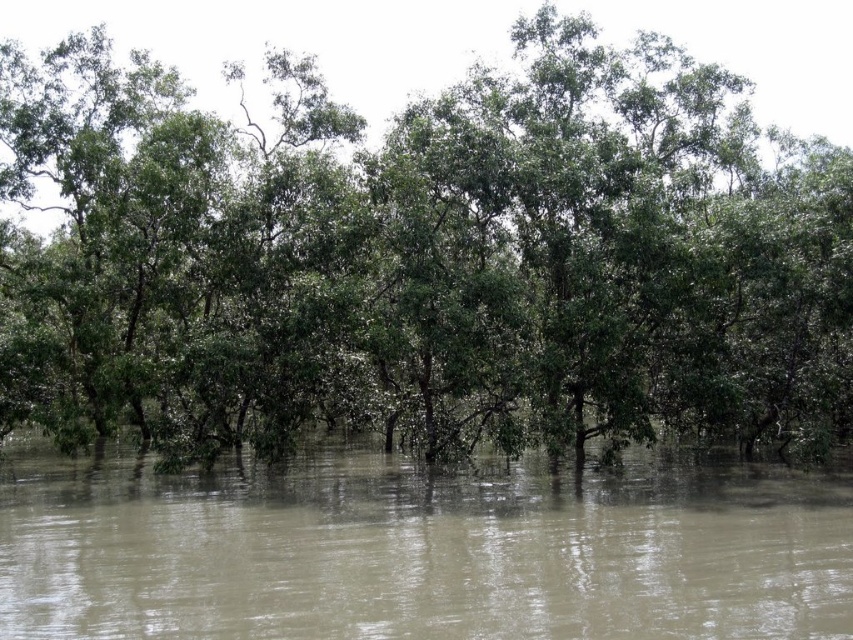
Question: Does green leafy trees at center have a greater width compared to brown muddy water at center?

Choices:
 (A) yes
 (B) no

Answer: (A)

Question: Does green leafy trees at center appear on the left side of brown muddy water at center?

Choices:
 (A) no
 (B) yes

Answer: (B)

Question: Which point is closer to the camera taking this photo?

Choices:
 (A) (689, 502)
 (B) (358, 312)

Answer: (A)

Question: Observing the image, what is the correct spatial positioning of green leafy trees at center in reference to brown muddy water at center?

Choices:
 (A) below
 (B) above

Answer: (B)